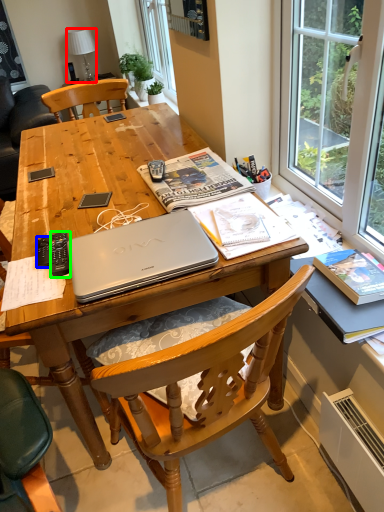
Question: Based on their relative distances, which object is nearer to lamp (highlighted by a red box)? Choose from remote control (highlighted by a blue box) and remote control (highlighted by a green box).

Choices:
 (A) remote control
 (B) remote control

Answer: (B)